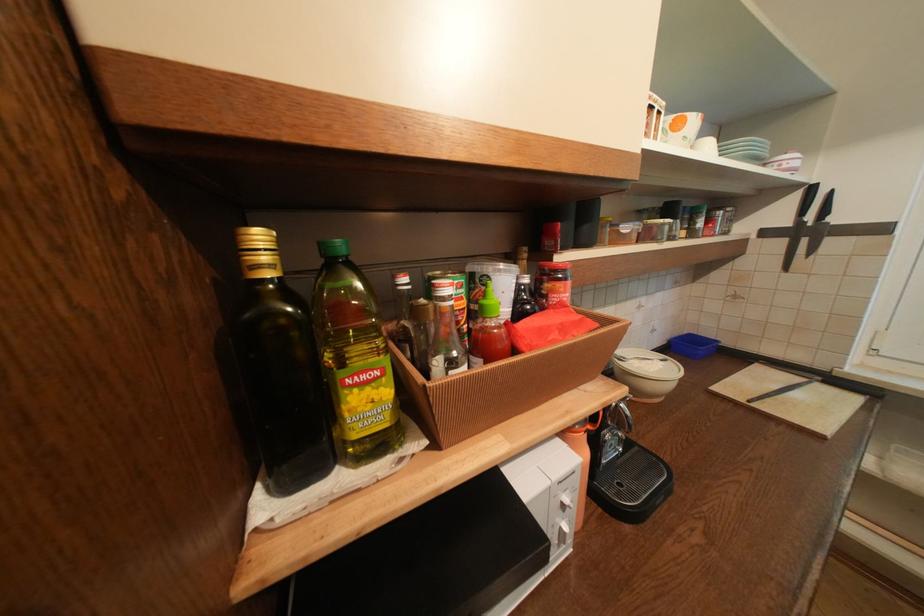
Where would you turn the white microwave dial? Please return your answer as a coordinate pair (x, y).

(564, 516)